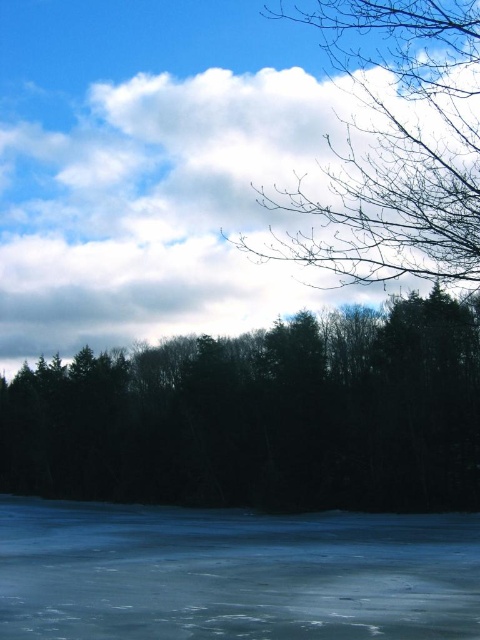
Question: Among these points, which one is farthest from the camera?

Choices:
 (A) (406, 35)
 (B) (204, 449)

Answer: (B)

Question: Which of the following is the closest to the observer?

Choices:
 (A) bare branches at upper right
 (B) transparent ice at bottom

Answer: (A)

Question: Is dark green textured trees at center to the left of bare branches at upper right from the viewer's perspective?

Choices:
 (A) yes
 (B) no

Answer: (A)

Question: Which object appears closest to the camera in this image?

Choices:
 (A) transparent ice at bottom
 (B) bare branches at upper right

Answer: (B)

Question: Can you confirm if dark green textured trees at center is positioned to the left of transparent ice at bottom?

Choices:
 (A) no
 (B) yes

Answer: (B)

Question: Is transparent ice at bottom wider than bare branches at upper right?

Choices:
 (A) yes
 (B) no

Answer: (A)